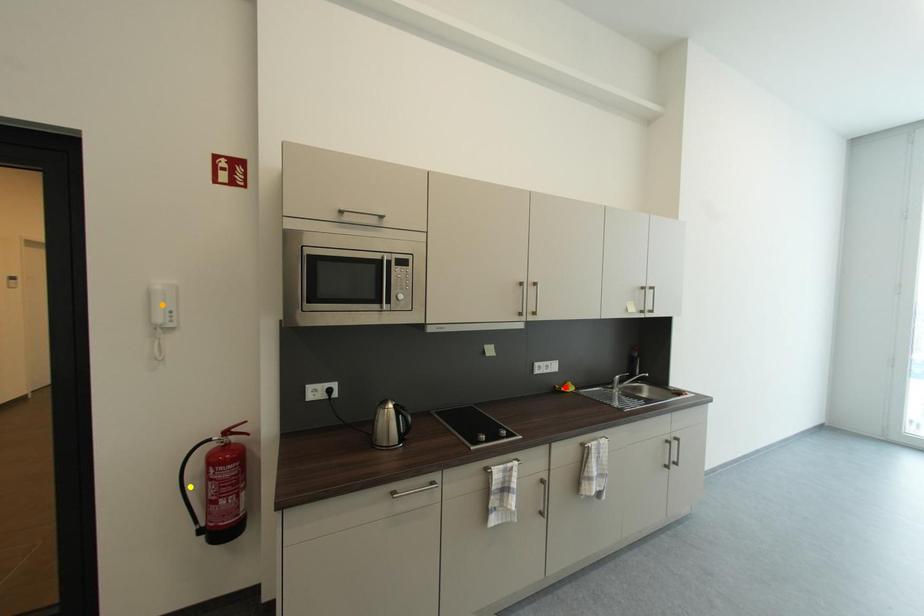
Order these from nearest to farthest:
A) red point
B) orange point
C) yellow point

orange point, yellow point, red point